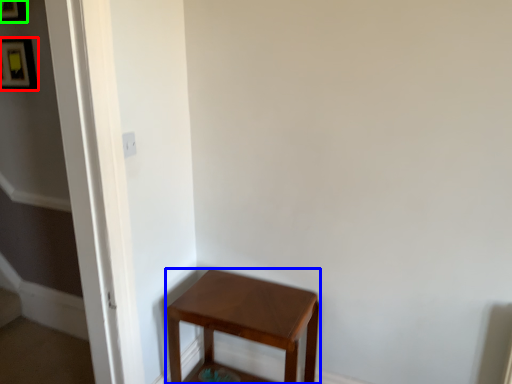
Question: Which object is positioned closest to picture frame (highlighted by a red box)? Select from stool (highlighted by a blue box) and picture frame (highlighted by a green box).

Choices:
 (A) stool
 (B) picture frame

Answer: (B)